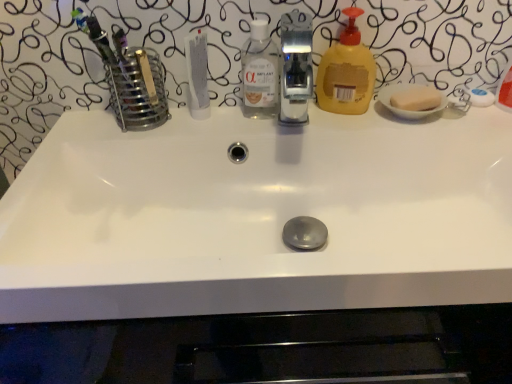
Where is `vacant area situated to the left side of transparent plastic bottle at center`? vacant area situated to the left side of transparent plastic bottle at center is located at coordinates (168, 120).